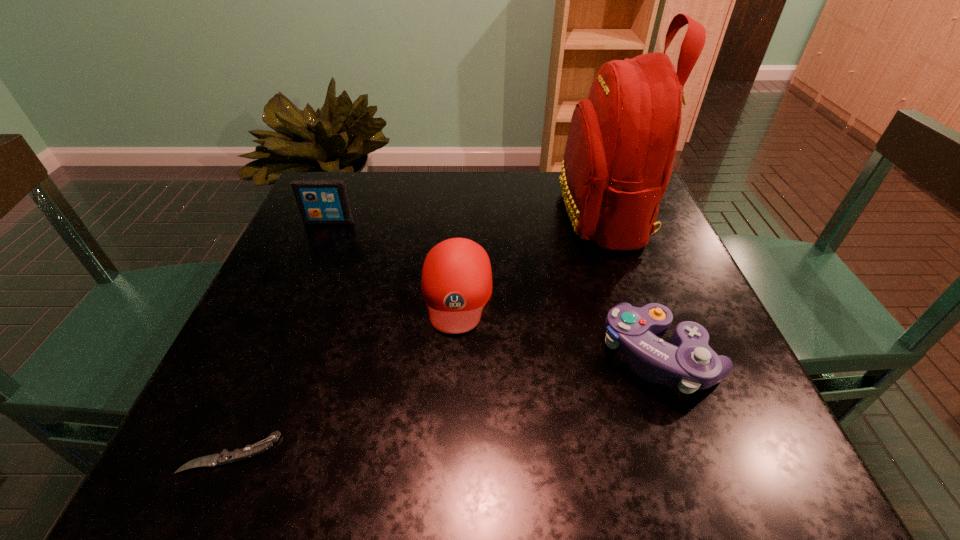
The width and height of the screenshot is (960, 540). Identify the location of free spot located 0.130m on the front-facing side of the baseball cap. (451, 399).

Locate an element on the screen. The width and height of the screenshot is (960, 540). vacant space located on the front of the control is located at coordinates (690, 437).

Locate an element on the screen. This screenshot has width=960, height=540. vacant space located on the back of the pocketknife is located at coordinates (253, 399).

Identify the location of backpack at the far edge. (622, 140).

This screenshot has height=540, width=960. What are the coordinates of `iPod located at the far edge` in the screenshot? It's located at pyautogui.click(x=320, y=201).

You are a GUI agent. You are given a task and a screenshot of the screen. Output one action in this format:
    pyautogui.click(x=<x>, y=<y>)
    Task: Click on the object located in the near edge section of the desktop
    The image size is (960, 540).
    Given the screenshot: What is the action you would take?
    pyautogui.click(x=225, y=457)

You are a GUI agent. You are given a task and a screenshot of the screen. Output one action in this format:
    pyautogui.click(x=<x>, y=<y>)
    Task: Click on the iPod present at the left edge
    The width and height of the screenshot is (960, 540).
    Given the screenshot: What is the action you would take?
    pyautogui.click(x=320, y=201)

Locate an element on the screen. pocketknife present at the left edge is located at coordinates (225, 457).

Locate an element on the screen. backpack that is at the right edge is located at coordinates (622, 140).

Image resolution: width=960 pixels, height=540 pixels. What are the coordinates of `control that is positioned at the right edge` in the screenshot? It's located at (689, 361).